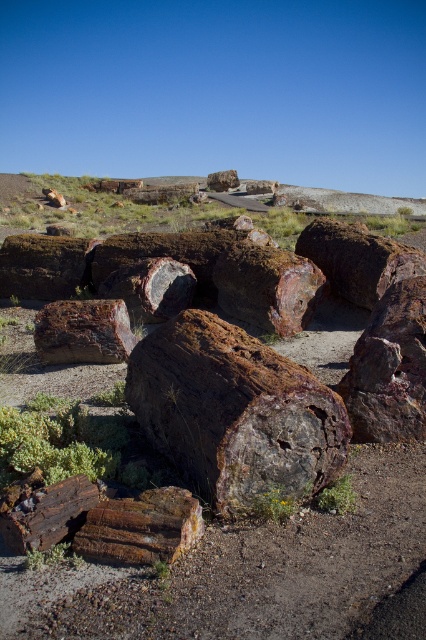
You are standing at the center of the desert scene. There is a point marked at coordinates (253, 573). According to the image description, what is located at that point?

The point at coordinates (253, 573) marks rusty wood logs at center.

You are a geologist examining the desert scene. You notice two logs at the center of the image. Which one is taller between the brown polished petrified wood at center and the rusty wood log at center?

The brown polished petrified wood at center is taller than the rusty wood log at center according to the description.